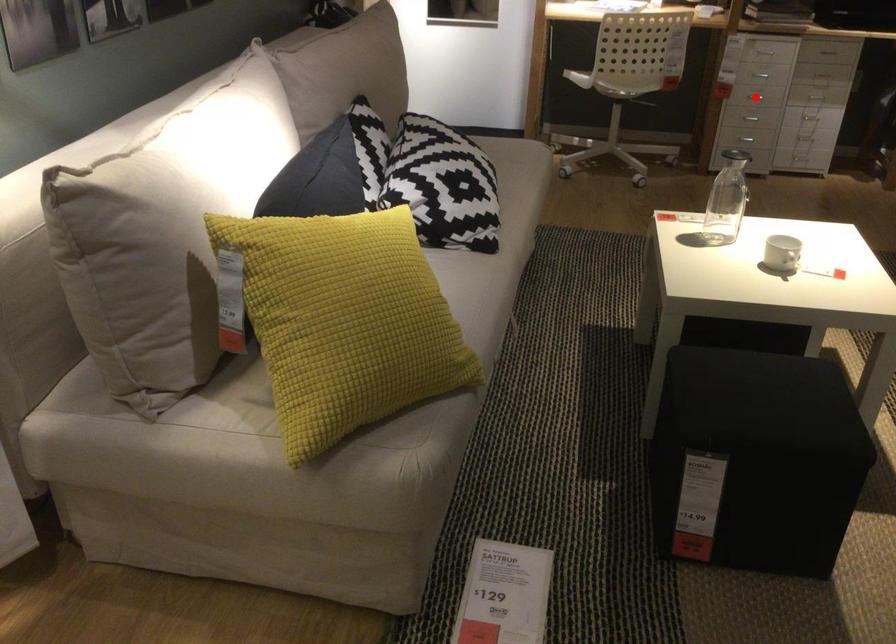
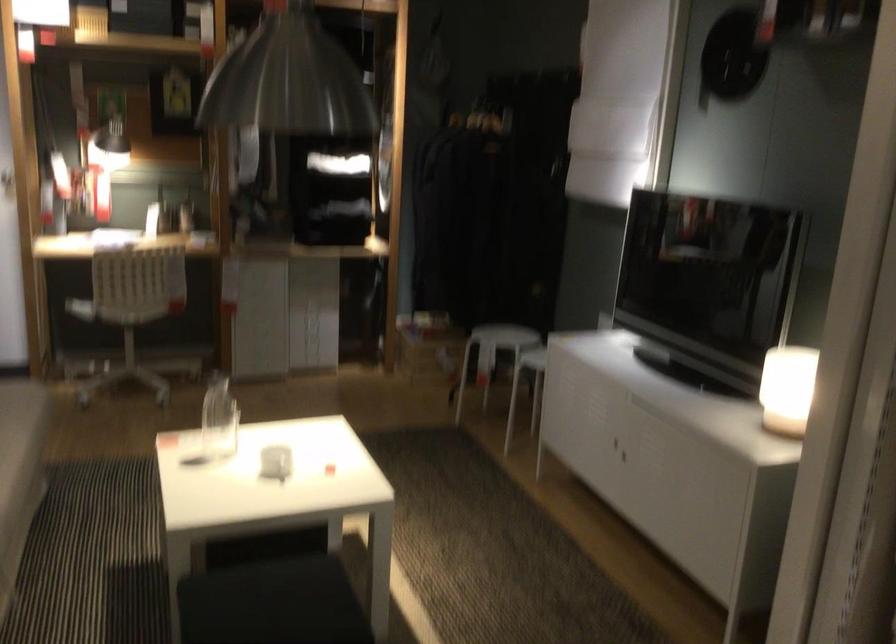
Question: I am providing you with two images of the same scene from different viewpoints. A red point is marked on the first image. Is the red point's position out of view in image 2?

Choices:
 (A) Yes
 (B) No

Answer: (A)